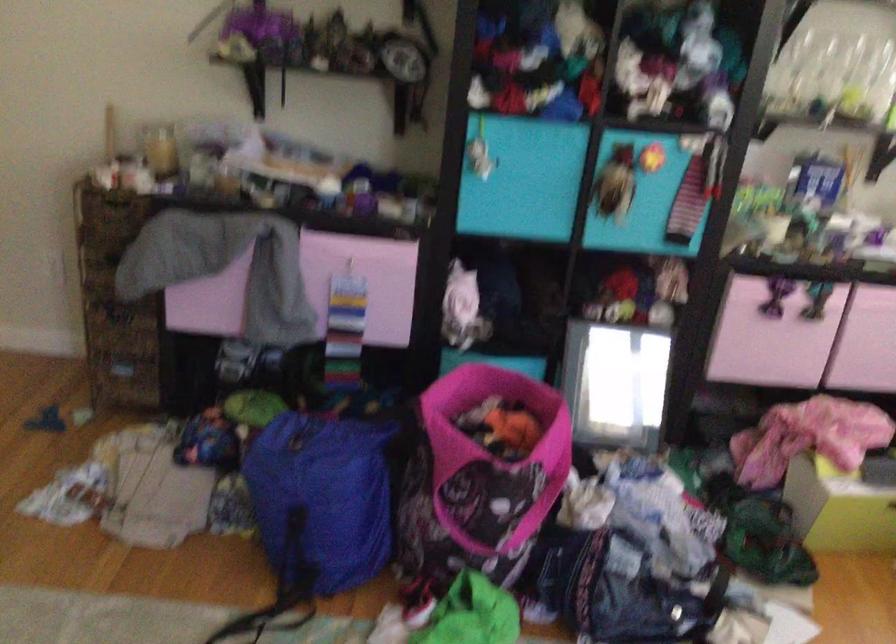
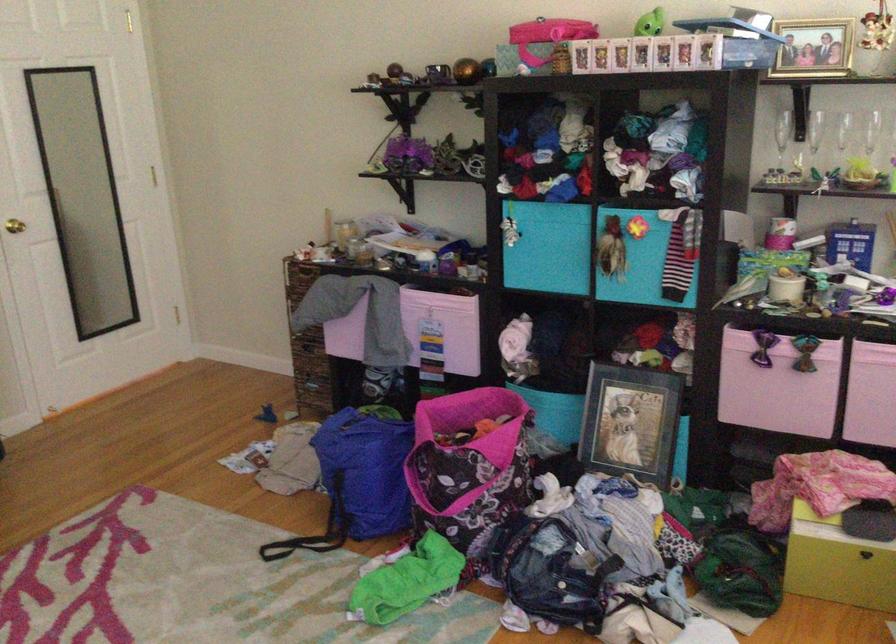
In the second image, find the point that corresponds to [479,526] in the first image.

(440, 498)